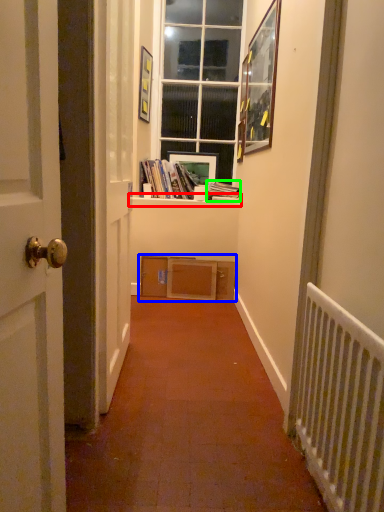
Question: Which object is positioned closest to window sill (highlighted by a red box)? Select from shelf (highlighted by a blue box) and paperback book (highlighted by a green box).

Choices:
 (A) shelf
 (B) paperback book

Answer: (B)